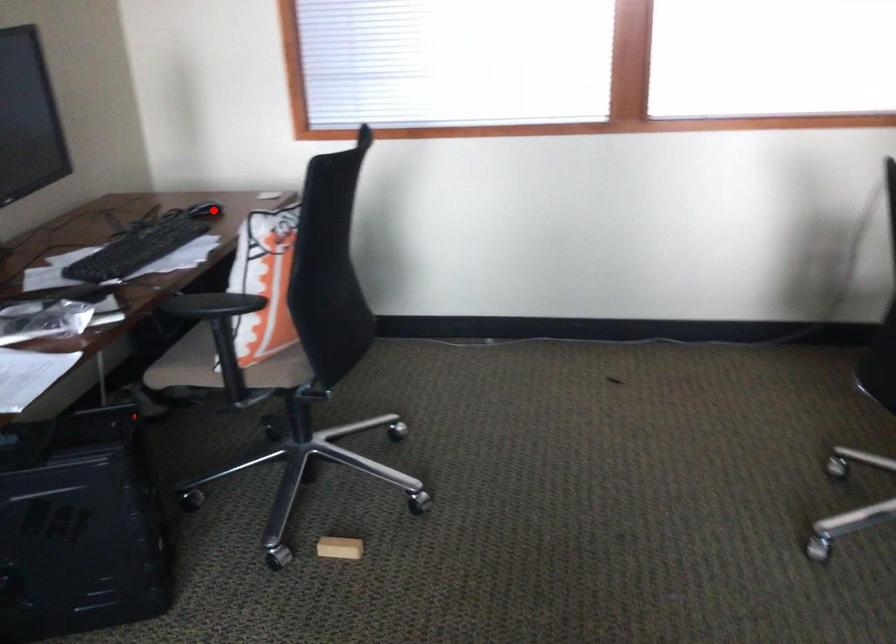
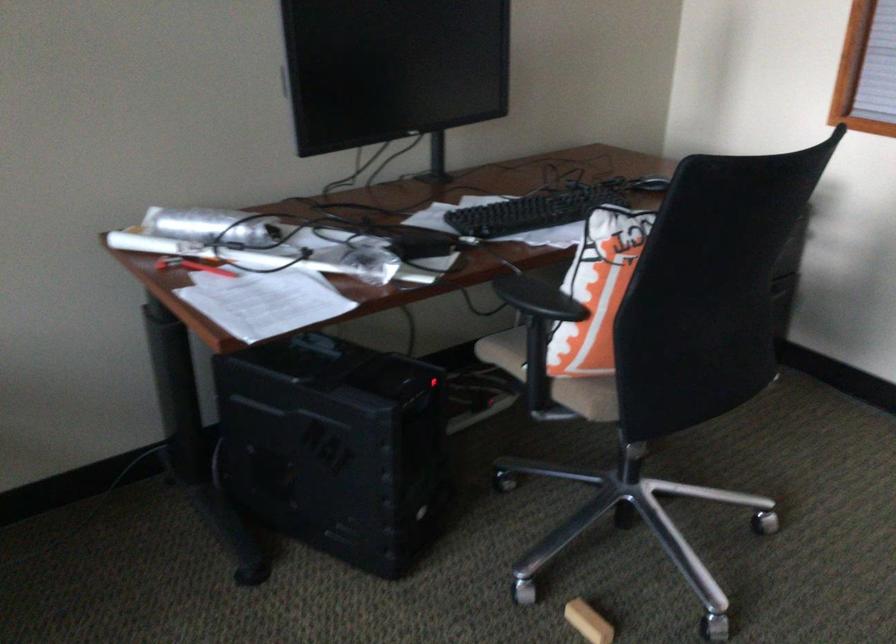
Question: I am providing you with two images of the same scene from different viewpoints. Given a red point in image1, look at the same physical point in image2. Is it:

Choices:
 (A) Closer to the viewpoint
 (B) Farther from the viewpoint

Answer: (A)